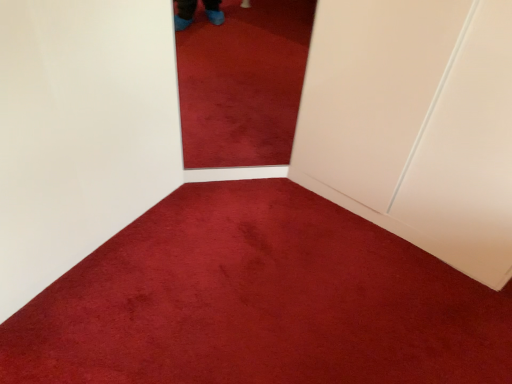
Question: From the image's perspective, is velvety red carpet at center above white matte door at right?

Choices:
 (A) yes
 (B) no

Answer: (B)

Question: Can you confirm if velvety red carpet at center is taller than white matte door at right?

Choices:
 (A) no
 (B) yes

Answer: (A)

Question: Can you confirm if velvety red carpet at center is wider than white matte door at right?

Choices:
 (A) yes
 (B) no

Answer: (A)

Question: Are velvety red carpet at center and white matte door at right located far from each other?

Choices:
 (A) no
 (B) yes

Answer: (A)

Question: Is white matte door at right a part of velvety red carpet at center?

Choices:
 (A) no
 (B) yes

Answer: (A)

Question: Does velvety red carpet at center appear on the left side of white matte door at right?

Choices:
 (A) yes
 (B) no

Answer: (A)

Question: Is the depth of white matte door at right greater than that of velvety red carpet at center?

Choices:
 (A) yes
 (B) no

Answer: (A)

Question: Does white matte door at right have a lesser height compared to velvety red carpet at center?

Choices:
 (A) yes
 (B) no

Answer: (B)

Question: Can you confirm if white matte door at right is thinner than velvety red carpet at center?

Choices:
 (A) no
 (B) yes

Answer: (B)

Question: Considering the relative positions of white matte door at right and velvety red carpet at center in the image provided, is white matte door at right to the right of velvety red carpet at center from the viewer's perspective?

Choices:
 (A) no
 (B) yes

Answer: (B)

Question: Is white matte door at right taller than velvety red carpet at center?

Choices:
 (A) yes
 (B) no

Answer: (A)

Question: Can you confirm if white matte door at right is positioned to the left of velvety red carpet at center?

Choices:
 (A) no
 (B) yes

Answer: (A)

Question: Relative to velvety red carpet at center, is white matte door at right in front or behind?

Choices:
 (A) behind
 (B) front

Answer: (A)